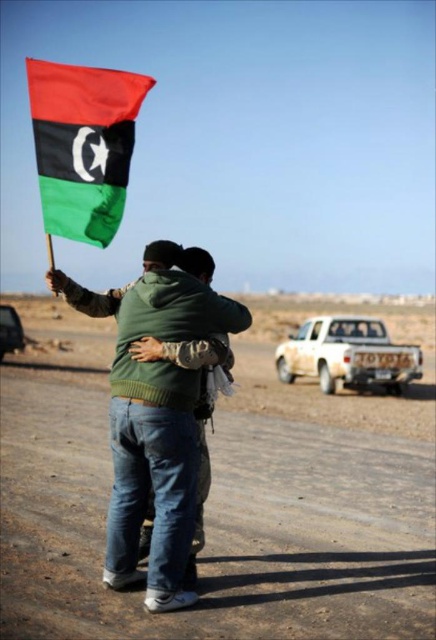
Question: Among these objects, which one is nearest to the camera?

Choices:
 (A) white matte truck at center
 (B) matte black flag at upper left

Answer: (B)

Question: Considering the real-world distances, which object is closest to the metallic silver car at lower left?

Choices:
 (A) matte black flag at upper left
 (B) white matte truck at center
 (C) green matte hoodie at center

Answer: (B)

Question: Among these points, which one is nearest to the camera?

Choices:
 (A) (350, 336)
 (B) (3, 316)

Answer: (A)

Question: Is white matte truck at center wider than metallic silver car at lower left?

Choices:
 (A) no
 (B) yes

Answer: (B)

Question: Can you confirm if matte black flag at upper left is thinner than white matte truck at center?

Choices:
 (A) yes
 (B) no

Answer: (B)

Question: Can you confirm if matte black flag at upper left is smaller than white matte truck at center?

Choices:
 (A) no
 (B) yes

Answer: (A)